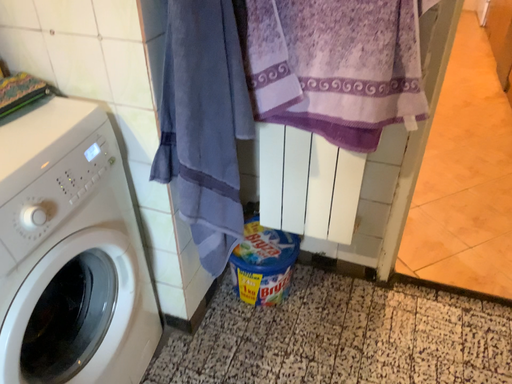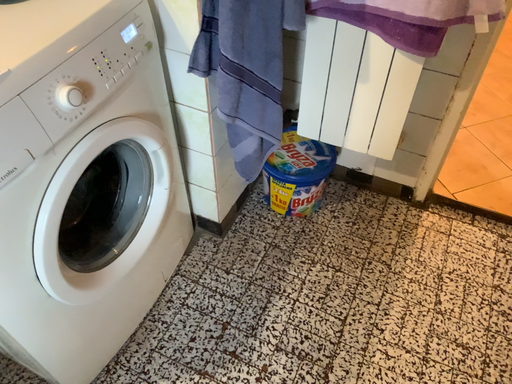
Question: How did the camera likely rotate when shooting the video?

Choices:
 (A) rotated downward
 (B) rotated upward

Answer: (A)